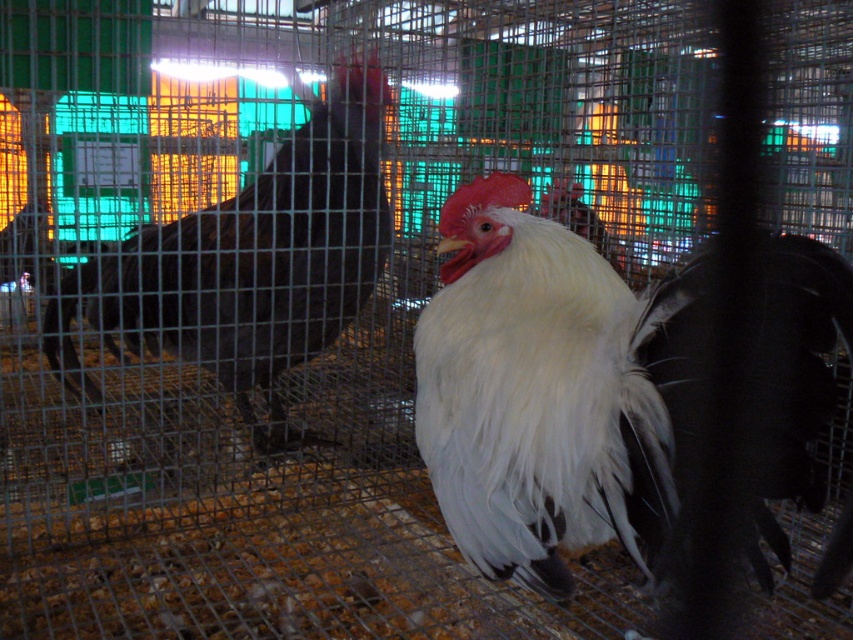
You are a poultry judge observing the chickens in the metal cage. You notice two roosters at the center. Which one is closer to you, the white fluffy rooster at center or the black glossy rooster at center?

The white fluffy rooster at center is closer to you because it is in front of the black glossy rooster at center.